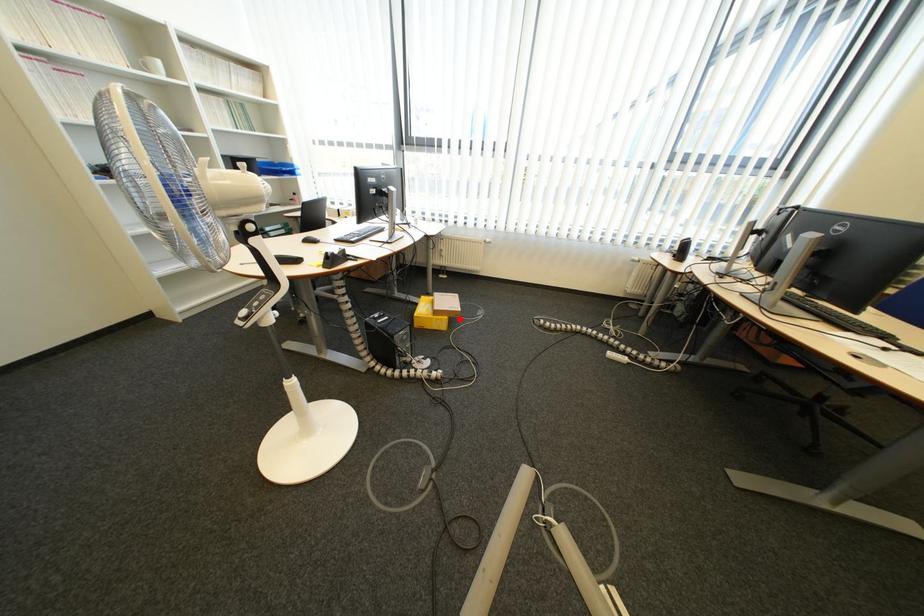
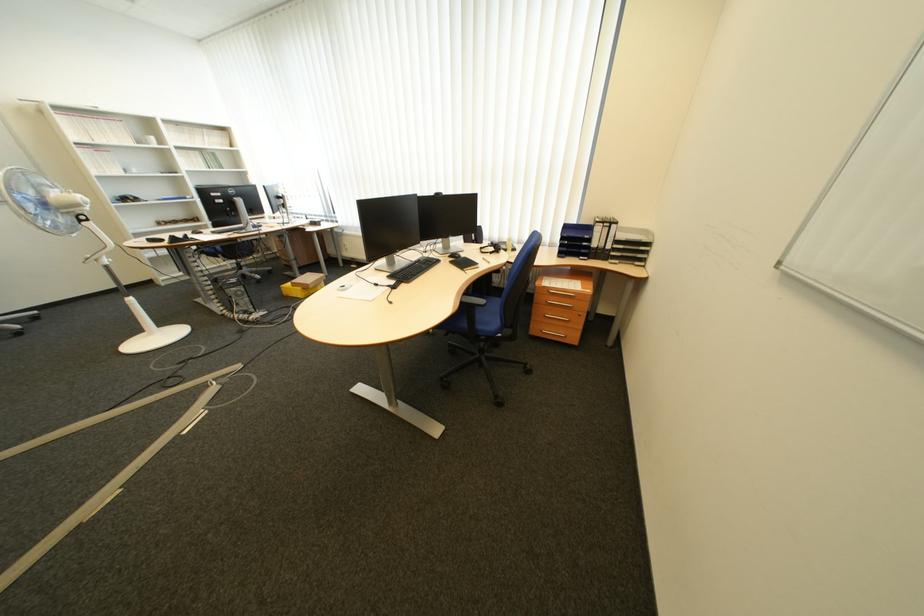
Find the pixel in the second image that matches the highlighted location in the first image.

(313, 290)